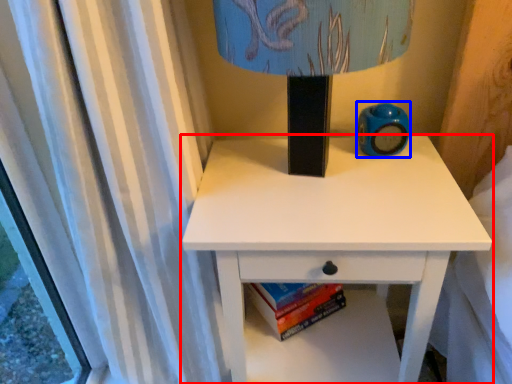
Question: Among these objects, which one is nearest to the camera, nightstand (highlighted by a red box) or teal (highlighted by a blue box)?

Choices:
 (A) nightstand
 (B) teal

Answer: (A)